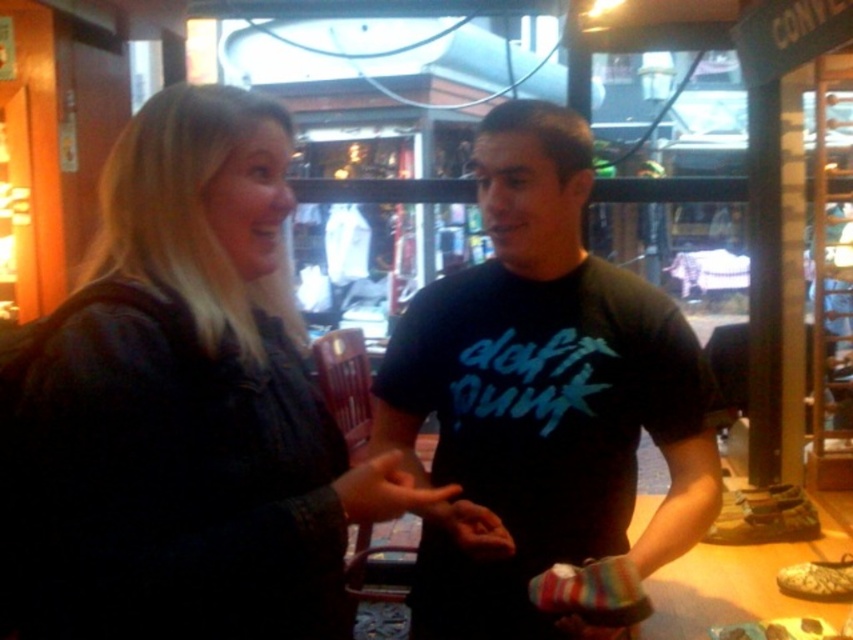
Consider the image. You are standing in a retail store and see two points marked in the scene. The first point is at coordinates point (x=15, y=481) and the second is at point (x=544, y=412). Which point is closer to you?

Point (x=15, y=481) is closer to the viewer than point (x=544, y=412).